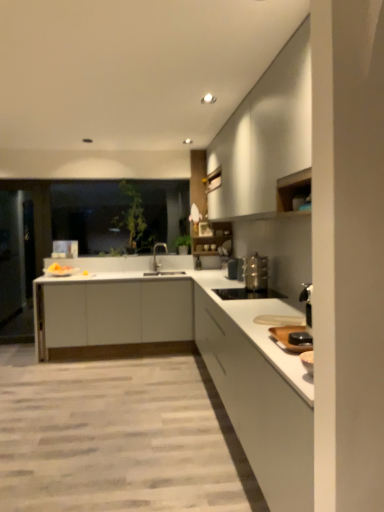
Question: From the image's perspective, is satin silver toaster at lower right, arranged as the 2th appliance when viewed from the top, under white matte countertop at center?

Choices:
 (A) yes
 (B) no

Answer: (B)

Question: Are satin silver toaster at lower right, the first appliance from the bottom, and white matte countertop at center beside each other?

Choices:
 (A) yes
 (B) no

Answer: (B)

Question: Does satin silver toaster at lower right, arranged as the 2th appliance when viewed from the top, have a lesser width compared to white matte countertop at center?

Choices:
 (A) no
 (B) yes

Answer: (B)

Question: Is satin silver toaster at lower right, arranged as the 2th appliance when viewed from the top, not within white matte countertop at center?

Choices:
 (A) yes
 (B) no

Answer: (A)

Question: Is the position of satin silver toaster at lower right, the first appliance from the bottom, less distant than that of white matte countertop at center?

Choices:
 (A) no
 (B) yes

Answer: (A)

Question: In terms of width, does transparent glass window at center look wider or thinner when compared to transparent glass door at left?

Choices:
 (A) wide
 (B) thin

Answer: (B)

Question: Would you say transparent glass window at center is to the left or to the right of transparent glass door at left in the picture?

Choices:
 (A) left
 (B) right

Answer: (B)

Question: From the image's perspective, is transparent glass window at center above or below transparent glass door at left?

Choices:
 (A) above
 (B) below

Answer: (A)

Question: Is transparent glass window at center situated inside transparent glass door at left or outside?

Choices:
 (A) inside
 (B) outside

Answer: (B)

Question: In terms of height, does white matte cabinet at upper right, positioned as the first cabinetry in top-to-bottom order, look taller or shorter compared to satin silver toaster at lower right, the first appliance from the bottom?

Choices:
 (A) tall
 (B) short

Answer: (A)

Question: Based on their positions, is white matte cabinet at upper right, positioned as the first cabinetry in top-to-bottom order, located to the left or right of satin silver toaster at lower right, arranged as the 2th appliance when viewed from the top?

Choices:
 (A) left
 (B) right

Answer: (B)

Question: Is white matte cabinet at upper right, positioned as the first cabinetry in top-to-bottom order, in front of or behind satin silver toaster at lower right, the first appliance from the bottom, in the image?

Choices:
 (A) behind
 (B) front

Answer: (B)

Question: From a real-world perspective, is white matte cabinet at upper right, positioned as the first cabinetry in top-to-bottom order, physically located above or below satin silver toaster at lower right, arranged as the 2th appliance when viewed from the top?

Choices:
 (A) below
 (B) above

Answer: (B)

Question: Is transparent glass door at left spatially inside white matte cabinet at right, the third cabinetry viewed from the top, or outside of it?

Choices:
 (A) outside
 (B) inside

Answer: (A)

Question: Is transparent glass door at left to the left or to the right of white matte cabinet at right, the third cabinetry viewed from the top, in the image?

Choices:
 (A) right
 (B) left

Answer: (B)